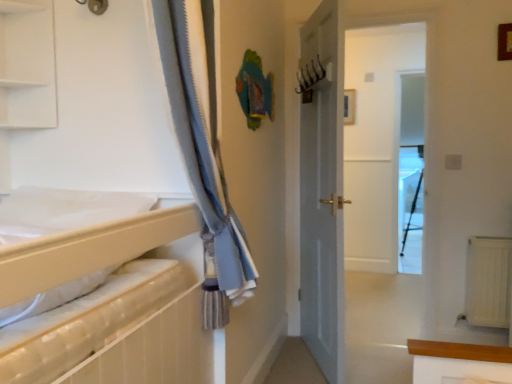
Question: Is white matte shelf at upper left turned away from white matte sheet at left?

Choices:
 (A) no
 (B) yes

Answer: (A)

Question: Considering the relative sizes of white matte shelf at upper left and white matte sheet at left in the image provided, is white matte shelf at upper left shorter than white matte sheet at left?

Choices:
 (A) no
 (B) yes

Answer: (A)

Question: From a real-world perspective, is white matte shelf at upper left positioned over white matte sheet at left based on gravity?

Choices:
 (A) yes
 (B) no

Answer: (A)

Question: Is white matte shelf at upper left facing towards white matte sheet at left?

Choices:
 (A) yes
 (B) no

Answer: (B)

Question: Is white matte shelf at upper left beside white matte sheet at left?

Choices:
 (A) no
 (B) yes

Answer: (A)

Question: Is white matte shelf at upper left wider or thinner than white matte sheet at left?

Choices:
 (A) thin
 (B) wide

Answer: (A)

Question: Considering the positions of white matte shelf at upper left and white matte sheet at left in the image, is white matte shelf at upper left taller or shorter than white matte sheet at left?

Choices:
 (A) tall
 (B) short

Answer: (A)

Question: Which is correct: white matte shelf at upper left is inside white matte sheet at left, or outside of it?

Choices:
 (A) inside
 (B) outside

Answer: (B)

Question: Is white matte shelf at upper left bigger or smaller than white matte sheet at left?

Choices:
 (A) big
 (B) small

Answer: (B)

Question: From the image's perspective, is white textured radiator at lower right positioned above or below white matte sheet at left?

Choices:
 (A) above
 (B) below

Answer: (B)

Question: From a real-world perspective, is white textured radiator at lower right above or below white matte sheet at left?

Choices:
 (A) above
 (B) below

Answer: (B)

Question: Which is correct: white textured radiator at lower right is inside white matte sheet at left, or outside of it?

Choices:
 (A) inside
 (B) outside

Answer: (B)

Question: Considering the positions of white textured radiator at lower right and white matte sheet at left in the image, is white textured radiator at lower right bigger or smaller than white matte sheet at left?

Choices:
 (A) big
 (B) small

Answer: (B)

Question: Is point (45, 231) positioned closer to the camera than point (414, 241)?

Choices:
 (A) closer
 (B) farther

Answer: (A)

Question: From the image's perspective, is white matte sheet at left positioned above or below transparent glass screen door at center?

Choices:
 (A) below
 (B) above

Answer: (A)